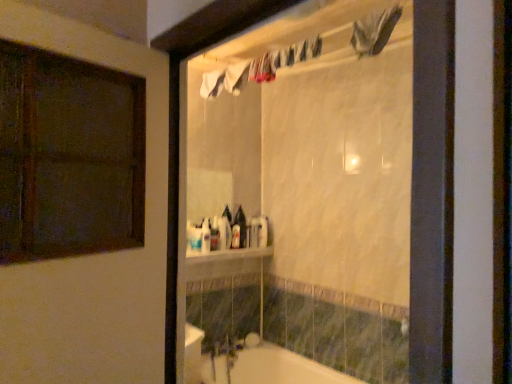
Question: Considering the relative sizes of white glossy bottle at center, placed as the fifth toiletry when sorted from right to left, and white glossy bathtub at lower center in the image provided, is white glossy bottle at center, placed as the fifth toiletry when sorted from right to left, thinner than white glossy bathtub at lower center?

Choices:
 (A) yes
 (B) no

Answer: (A)

Question: Does white glossy bottle at center, the fifth toiletry from the back, appear on the right side of white glossy bathtub at lower center?

Choices:
 (A) no
 (B) yes

Answer: (A)

Question: From a real-world perspective, is white glossy bottle at center, the 1th toiletry in the front-to-back sequence, on top of white glossy bathtub at lower center?

Choices:
 (A) no
 (B) yes

Answer: (B)

Question: From the image's perspective, is white glossy bottle at center, the 1th toiletry in the left-to-right sequence, below white glossy bathtub at lower center?

Choices:
 (A) no
 (B) yes

Answer: (A)

Question: From the image's perspective, relative to white glossy bathtub at lower center, is translucent plastic container at center, which is counted as the 4th toiletry, starting from the front, above or below?

Choices:
 (A) above
 (B) below

Answer: (A)

Question: Choose the correct answer: Is translucent plastic container at center, the 4th toiletry when ordered from left to right, inside white glossy bathtub at lower center or outside it?

Choices:
 (A) inside
 (B) outside

Answer: (B)

Question: From a real-world perspective, is translucent plastic container at center, which is the 2th toiletry in right-to-left order, physically located above or below white glossy bathtub at lower center?

Choices:
 (A) below
 (B) above

Answer: (B)

Question: Is point (257, 231) closer or farther from the camera than point (248, 362)?

Choices:
 (A) farther
 (B) closer

Answer: (A)

Question: In the image, is white glossy bottle at center, which is counted as the first toiletry, starting from the back, positioned in front of or behind translucent plastic container at center, the 4th toiletry when ordered from left to right?

Choices:
 (A) front
 (B) behind

Answer: (B)

Question: In terms of height, does white glossy bottle at center, which is counted as the first toiletry, starting from the back, look taller or shorter compared to translucent plastic container at center, the second toiletry when ordered from back to front?

Choices:
 (A) tall
 (B) short

Answer: (B)

Question: From the image's perspective, is white glossy bottle at center, which is counted as the 5th toiletry, starting from the left, above or below translucent plastic container at center, the 4th toiletry when ordered from left to right?

Choices:
 (A) above
 (B) below

Answer: (B)

Question: Based on their positions, is white glossy bottle at center, which is counted as the 5th toiletry, starting from the left, located to the left or right of translucent plastic container at center, which is counted as the 4th toiletry, starting from the front?

Choices:
 (A) left
 (B) right

Answer: (B)

Question: Considering the relative positions of white glossy bottle at center, which is counted as the 5th toiletry, starting from the left, and white plastic bottle at center, which is the third toiletry from right to left, in the image provided, is white glossy bottle at center, which is counted as the 5th toiletry, starting from the left, to the left or to the right of white plastic bottle at center, which is the third toiletry from right to left,?

Choices:
 (A) left
 (B) right

Answer: (B)

Question: From a real-world perspective, is white glossy bottle at center, which is the first toiletry from right to left, positioned above or below white plastic bottle at center, which is the third toiletry from right to left?

Choices:
 (A) above
 (B) below

Answer: (A)